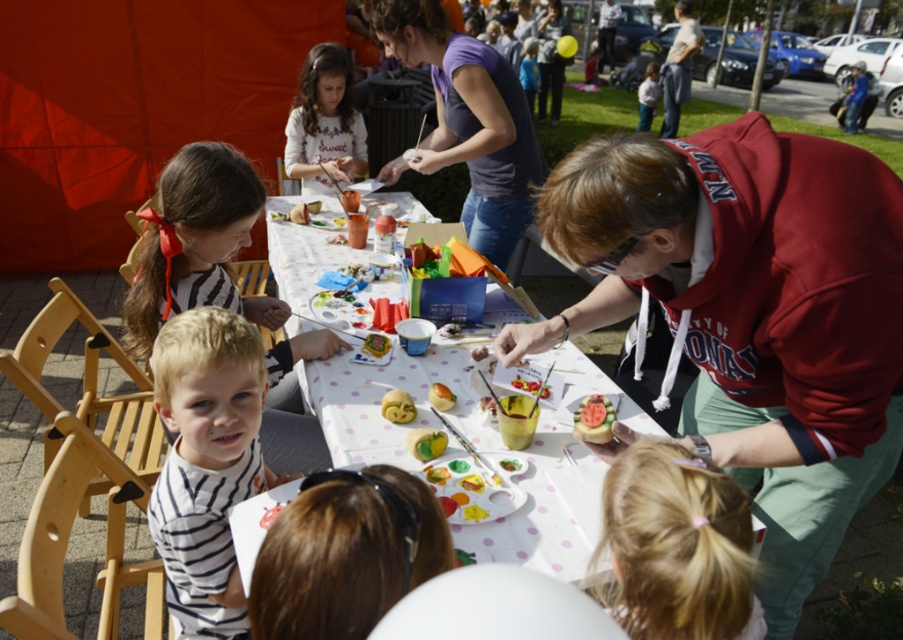
Question: Observing the image, what is the correct spatial positioning of purple cotton shirt at upper center in reference to white cotton shirt at upper center?

Choices:
 (A) below
 (B) above

Answer: (A)

Question: Is white polka dot paper at center smaller than smooth white cake at center?

Choices:
 (A) no
 (B) yes

Answer: (A)

Question: Considering the relative positions of white striped shirt at lower left and white cotton shirt at upper center in the image provided, where is white striped shirt at lower left located with respect to white cotton shirt at upper center?

Choices:
 (A) above
 (B) below

Answer: (B)

Question: Which point is closer to the camera taking this photo?

Choices:
 (A) (589, 435)
 (B) (392, 397)
 (C) (306, 205)

Answer: (A)

Question: Which object appears closest to the camera in this image?

Choices:
 (A) yellow matte fruit at center
 (B) smooth white cake at center
 (C) white cotton shirt at upper center

Answer: (B)

Question: Estimate the real-world distances between objects in this image. Which object is farther from the smooth white cake at center?

Choices:
 (A) white polka dot paper at center
 (B) matte red hoodie at center
 (C) purple cotton shirt at upper center
 (D) white cotton shirt at upper center

Answer: (D)